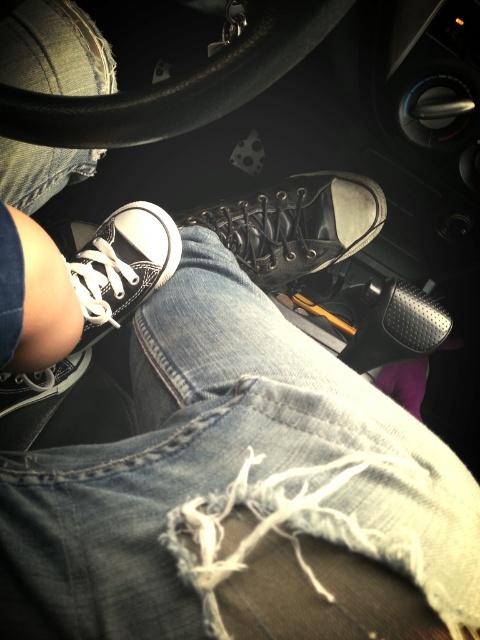
You are a delivery robot that is 0.5 meters wide. You need to move from the driver seat to the point marked at coordinates point (324, 241). Is there enough space for you to pass through?

The distance of point (324, 241) from camera is 1.06 meters, so yes, the robot can pass through since the distance is greater than the robot width of 0.5 meters.

You are sitting in the back seat of the car and want to place a small toy on the floor. You see two points marked in the image. Which point, point 1 at coordinates (357, 177) or point 2 at coordinates (36, 10), is closer to you so you can easily reach it?

Point 1 at coordinates (357, 177) is closer to you because it is further to the viewer than point 2 at coordinates (36, 10), making it easier to reach.